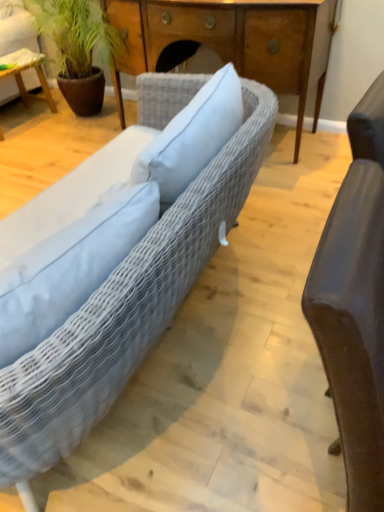
Where is `free space to the left of matte brown leather chair at right`? This screenshot has height=512, width=384. free space to the left of matte brown leather chair at right is located at coordinates (255, 356).